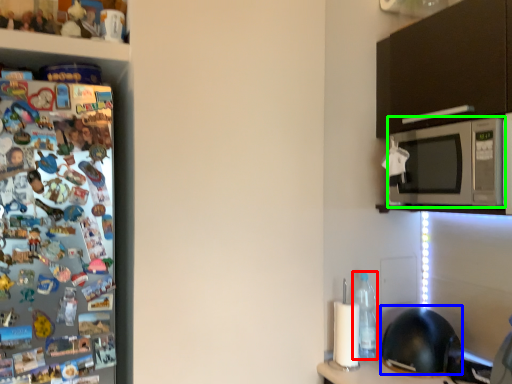
Question: Estimate the real-world distances between objects in this image. Which object is farther from bottle (highlighted by a red box), helmet (highlighted by a blue box) or microwave oven (highlighted by a green box)?

Choices:
 (A) helmet
 (B) microwave oven

Answer: (B)